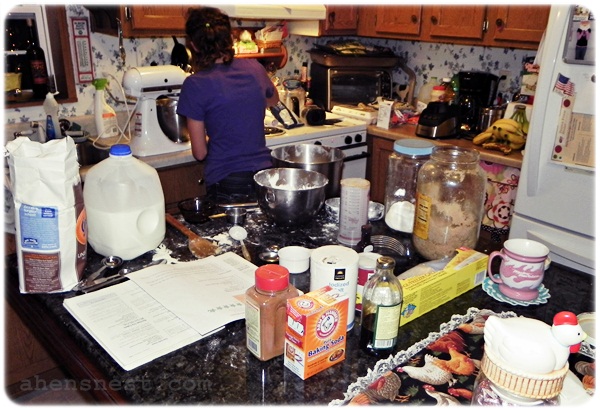
You are a GUI agent. You are given a task and a screenshot of the screen. Output one action in this format:
    pyautogui.click(x=<x>, y=<y>)
    Task: Click on the cabinet
    The height and width of the screenshot is (410, 600).
    Given the screenshot: What is the action you would take?
    pyautogui.click(x=449, y=19)